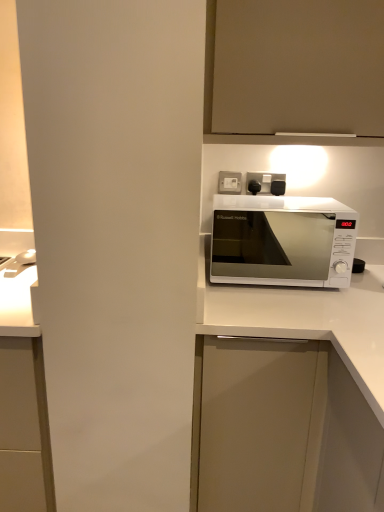
The width and height of the screenshot is (384, 512). What do you see at coordinates (282, 430) in the screenshot? I see `white matte cabinet at center, which is the 1th cabinetry in bottom-to-top order` at bounding box center [282, 430].

Locate an element on the screen. white matte cabinet at center, which appears as the 2th cabinetry when viewed from the top is located at coordinates (282, 430).

Relative to white glossy microwave at center, is white matte cabinet at center, which is the 1th cabinetry in bottom-to-top order, in front or behind?

Clearly, white matte cabinet at center, which is the 1th cabinetry in bottom-to-top order, is in front of white glossy microwave at center.

Considering the sizes of objects white matte cabinet at center, which is the 1th cabinetry in bottom-to-top order, and white glossy microwave at center in the image provided, who is wider, white matte cabinet at center, which is the 1th cabinetry in bottom-to-top order, or white glossy microwave at center?

white matte cabinet at center, which is the 1th cabinetry in bottom-to-top order, is wider.

Is white glossy microwave at center surrounded by white matte cabinet at center, which appears as the 2th cabinetry when viewed from the top?

Actually, white glossy microwave at center is outside white matte cabinet at center, which appears as the 2th cabinetry when viewed from the top.

Between matte white cabinet at upper center, arranged as the first cabinetry when viewed from the top, and white plastic socket at upper center, which one has larger size?

matte white cabinet at upper center, arranged as the first cabinetry when viewed from the top.

Would you say matte white cabinet at upper center, which is counted as the 2th cabinetry, starting from the bottom, is inside or outside white plastic socket at upper center?

matte white cabinet at upper center, which is counted as the 2th cabinetry, starting from the bottom, exists outside the volume of white plastic socket at upper center.

From the image's perspective, which is above, matte white cabinet at upper center, which is counted as the 2th cabinetry, starting from the bottom, or white plastic socket at upper center?

matte white cabinet at upper center, which is counted as the 2th cabinetry, starting from the bottom, from the image's perspective.

Is point (318, 75) closer to camera compared to point (237, 185)?

Yes, point (318, 75) is in front of point (237, 185).

Consider the image. Which object is thinner, white plastic socket at upper center or white glossy microwave at center?

Thinner between the two is white plastic socket at upper center.

Relative to white glossy microwave at center, is white plastic socket at upper center in front or behind?

white plastic socket at upper center is behind white glossy microwave at center.

From the image's perspective, which is above, white plastic socket at upper center or white glossy microwave at center?

white plastic socket at upper center is shown above in the image.

Based on their sizes in the image, would you say white glossy microwave at center is bigger or smaller than white plastic socket at upper center?

Clearly, white glossy microwave at center is larger in size than white plastic socket at upper center.

Is there a large distance between white glossy microwave at center and white plastic socket at upper center?

Yes, white glossy microwave at center is far from white plastic socket at upper center.

From the image's perspective, is white glossy microwave at center beneath white plastic socket at upper center?

Yes.

Does white plastic socket at upper center touch white matte cabinet at center, which appears as the 2th cabinetry when viewed from the top?

No, white plastic socket at upper center is not with white matte cabinet at center, which appears as the 2th cabinetry when viewed from the top.

Is white plastic socket at upper center thinner than white matte cabinet at center, which appears as the 2th cabinetry when viewed from the top?

Yes.

Is white plastic socket at upper center further to the viewer compared to white matte cabinet at center, which appears as the 2th cabinetry when viewed from the top?

Yes, white plastic socket at upper center is behind white matte cabinet at center, which appears as the 2th cabinetry when viewed from the top.

Could you tell me if matte white cabinet at upper center, arranged as the first cabinetry when viewed from the top, is turned towards white glossy microwave at center?

No, matte white cabinet at upper center, arranged as the first cabinetry when viewed from the top, is not oriented towards white glossy microwave at center.

What are the coordinates of `cabinetry that appears on the right of white glossy microwave at center` in the screenshot? It's located at (294, 66).

From the picture: Is matte white cabinet at upper center, arranged as the first cabinetry when viewed from the top, in front of or behind white glossy microwave at center in the image?

matte white cabinet at upper center, arranged as the first cabinetry when viewed from the top, is in front of white glossy microwave at center.

Does matte white cabinet at upper center, arranged as the first cabinetry when viewed from the top, appear on the right side of white glossy microwave at center?

Yes, matte white cabinet at upper center, arranged as the first cabinetry when viewed from the top, is to the right of white glossy microwave at center.

Is point (239, 447) in front of point (228, 178)?

That is True.

Which is behind, white matte cabinet at center, which appears as the 2th cabinetry when viewed from the top, or white plastic socket at upper center?

white plastic socket at upper center is behind.

You are a GUI agent. You are given a task and a screenshot of the screen. Output one action in this format:
    pyautogui.click(x=<x>, y=<y>)
    Task: Click on the electric outlet that appears above the white matte cabinet at center, which appears as the 2th cabinetry when viewed from the top (from the image's perspective)
    This screenshot has width=384, height=512.
    Given the screenshot: What is the action you would take?
    pyautogui.click(x=229, y=182)

Can you confirm if white matte cabinet at center, which appears as the 2th cabinetry when viewed from the top, is thinner than white plastic socket at upper center?

In fact, white matte cabinet at center, which appears as the 2th cabinetry when viewed from the top, might be wider than white plastic socket at upper center.

The width and height of the screenshot is (384, 512). What are the coordinates of `microwave oven on the right of white matte cabinet at center, which appears as the 2th cabinetry when viewed from the top` in the screenshot? It's located at (281, 241).

Find the location of a particular element. The width and height of the screenshot is (384, 512). electric outlet to the left of matte white cabinet at upper center, arranged as the first cabinetry when viewed from the top is located at coordinates (229, 182).

When comparing their distances from white plastic socket at upper center, does white matte cabinet at center, which is the 1th cabinetry in bottom-to-top order, or matte white cabinet at upper center, arranged as the first cabinetry when viewed from the top, seem further?

white matte cabinet at center, which is the 1th cabinetry in bottom-to-top order, is positioned further to the anchor white plastic socket at upper center.

Looking at the image, which one is located closer to white matte cabinet at center, which appears as the 2th cabinetry when viewed from the top, white plastic socket at upper center or matte white cabinet at upper center, which is counted as the 2th cabinetry, starting from the bottom?

white plastic socket at upper center lies closer to white matte cabinet at center, which appears as the 2th cabinetry when viewed from the top, than the other object.

Based on their spatial positions, is matte white cabinet at upper center, arranged as the first cabinetry when viewed from the top, or white matte cabinet at center, which is the 1th cabinetry in bottom-to-top order, further from white glossy microwave at center?

Among the two, white matte cabinet at center, which is the 1th cabinetry in bottom-to-top order, is located further to white glossy microwave at center.

Looking at the image, which one is located closer to white glossy microwave at center, white plastic socket at upper center or white matte cabinet at center, which appears as the 2th cabinetry when viewed from the top?

white plastic socket at upper center.

Looking at the image, which one is located closer to matte white cabinet at upper center, arranged as the first cabinetry when viewed from the top, white matte cabinet at center, which is the 1th cabinetry in bottom-to-top order, or white glossy microwave at center?

The object closer to matte white cabinet at upper center, arranged as the first cabinetry when viewed from the top, is white matte cabinet at center, which is the 1th cabinetry in bottom-to-top order.

Based on their spatial positions, is white plastic socket at upper center or matte white cabinet at upper center, arranged as the first cabinetry when viewed from the top, further from white glossy microwave at center?

matte white cabinet at upper center, arranged as the first cabinetry when viewed from the top, is positioned further to the anchor white glossy microwave at center.

Which object lies nearer to the anchor point matte white cabinet at upper center, arranged as the first cabinetry when viewed from the top, white plastic socket at upper center or white matte cabinet at center, which is the 1th cabinetry in bottom-to-top order?

white plastic socket at upper center is positioned closer to the anchor matte white cabinet at upper center, arranged as the first cabinetry when viewed from the top.

Looking at this image, estimate the real-world distances between objects in this image. Which object is further from white plastic socket at upper center, white glossy microwave at center or white matte cabinet at center, which appears as the 2th cabinetry when viewed from the top?

white glossy microwave at center lies further to white plastic socket at upper center than the other object.

At what (x,y) coordinates should I click in order to perform the action: click on electric outlet between matte white cabinet at upper center, which is counted as the 2th cabinetry, starting from the bottom, and white matte cabinet at center, which is the 1th cabinetry in bottom-to-top order, vertically. Please return your answer as a coordinate pair (x, y). Looking at the image, I should click on (229, 182).

The width and height of the screenshot is (384, 512). In order to click on microwave oven between matte white cabinet at upper center, arranged as the first cabinetry when viewed from the top, and white matte cabinet at center, which is the 1th cabinetry in bottom-to-top order, vertically in this screenshot , I will do (x=281, y=241).

Find the location of a particular element. This screenshot has width=384, height=512. microwave oven between white plastic socket at upper center and white matte cabinet at center, which appears as the 2th cabinetry when viewed from the top, in the vertical direction is located at coordinates pyautogui.click(x=281, y=241).

At what (x,y) coordinates should I click in order to perform the action: click on electric outlet between matte white cabinet at upper center, which is counted as the 2th cabinetry, starting from the bottom, and white glossy microwave at center, in the vertical direction. Please return your answer as a coordinate pair (x, y). This screenshot has height=512, width=384. Looking at the image, I should click on (229, 182).